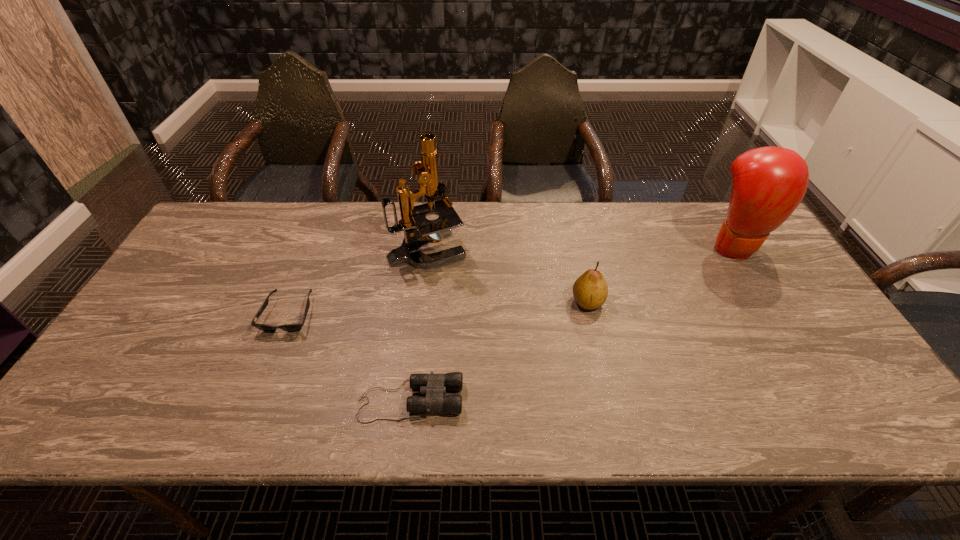
At what (x,y) coordinates should I click in order to perform the action: click on unoccupied area between the fourth shortest object and the binoculars. Please return your answer as a coordinate pair (x, y). Looking at the image, I should click on (572, 323).

This screenshot has width=960, height=540. I want to click on vacant region between the nearest object and the microscope, so click(x=419, y=325).

At what (x,y) coordinates should I click in order to perform the action: click on the third closest object to the boxing glove. Please return your answer as a coordinate pair (x, y). This screenshot has height=540, width=960. Looking at the image, I should click on (434, 386).

Choose which object is the third nearest neighbor to the binoculars. Please provide its 2D coordinates. Your answer should be formatted as a tuple, i.e. [(x, y)], where the tuple contains the x and y coordinates of a point satisfying the conditions above.

[(413, 217)]

Locate an element on the screen. The width and height of the screenshot is (960, 540). vacant region that satisfies the following two spatial constraints: 1. on the striking surface of the second tallest object; 2. at the eyepiece of the binoculars is located at coordinates (829, 401).

Locate an element on the screen. The height and width of the screenshot is (540, 960). vacant area that satisfies the following two spatial constraints: 1. at the eyepiece of the third shortest object; 2. on the right side of the microscope is located at coordinates (420, 301).

In order to click on free space that satisfies the following two spatial constraints: 1. on the striking surface of the rightmost object; 2. at the eyepiece of the microscope in this screenshot , I will do `click(735, 248)`.

Identify the location of free space that satisfies the following two spatial constraints: 1. at the eyepiece of the pear; 2. on the right side of the microscope. (420, 301).

Image resolution: width=960 pixels, height=540 pixels. I want to click on vacant space that satisfies the following two spatial constraints: 1. on the striking surface of the second tallest object; 2. at the eyepiece of the microscope, so click(735, 248).

Where is `vacant space that satisfies the following two spatial constraints: 1. on the back side of the pear; 2. at the eyepiece of the microscope`? vacant space that satisfies the following two spatial constraints: 1. on the back side of the pear; 2. at the eyepiece of the microscope is located at coordinates (575, 248).